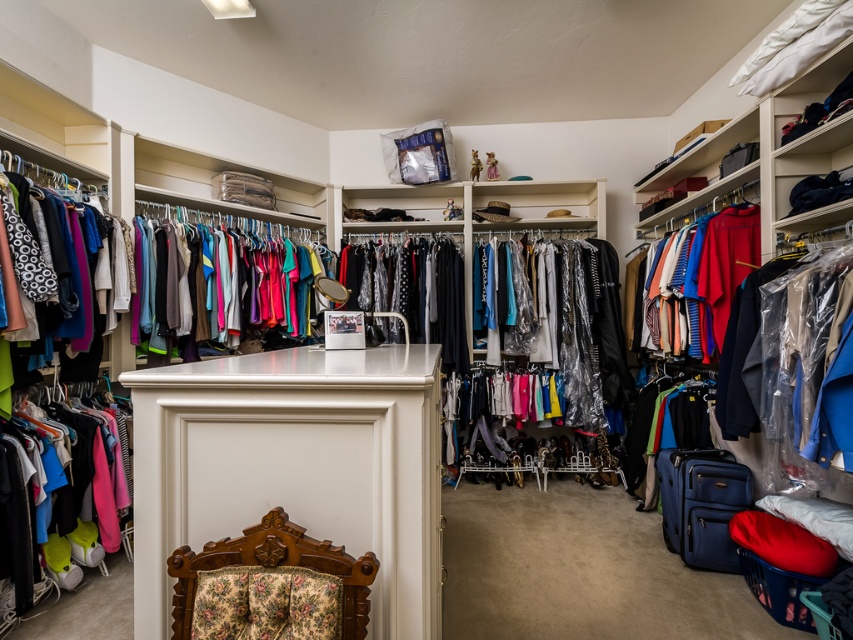
Can you confirm if clear plastic coat at center is bigger than floral fabric chair at lower center?

Yes, clear plastic coat at center is bigger than floral fabric chair at lower center.

Who is more forward, [614,326] or [332,563]?

Point [332,563]

Identify the location of clear plastic coat at center. Image resolution: width=853 pixels, height=640 pixels. (587, 330).

Who is positioned more to the right, clear plastic coat at center or matte fabric shirts at right?

matte fabric shirts at right

Measure the distance from clear plastic coat at center to matte fabric shirts at right.

A distance of 1.07 meters exists between clear plastic coat at center and matte fabric shirts at right.

Which is in front, point (567, 353) or point (746, 221)?

Point (746, 221) is in front.

The width and height of the screenshot is (853, 640). Find the location of `clear plastic coat at center`. clear plastic coat at center is located at coordinates (587, 330).

Can you confirm if matte plastic coat at right is smaller than floral fabric chair at lower center?

No.

Does matte plastic coat at right come behind floral fabric chair at lower center?

Yes, it is behind floral fabric chair at lower center.

Is point (769, 312) closer to camera compared to point (288, 525)?

No, (769, 312) is behind (288, 525).

Where is `matte plastic coat at right`? matte plastic coat at right is located at coordinates (791, 372).